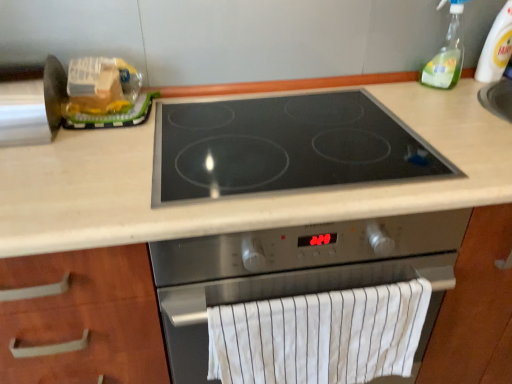
The image size is (512, 384). In order to click on blank space above black glass cooktop at center (from a real-world perspective) in this screenshot , I will do tap(288, 150).